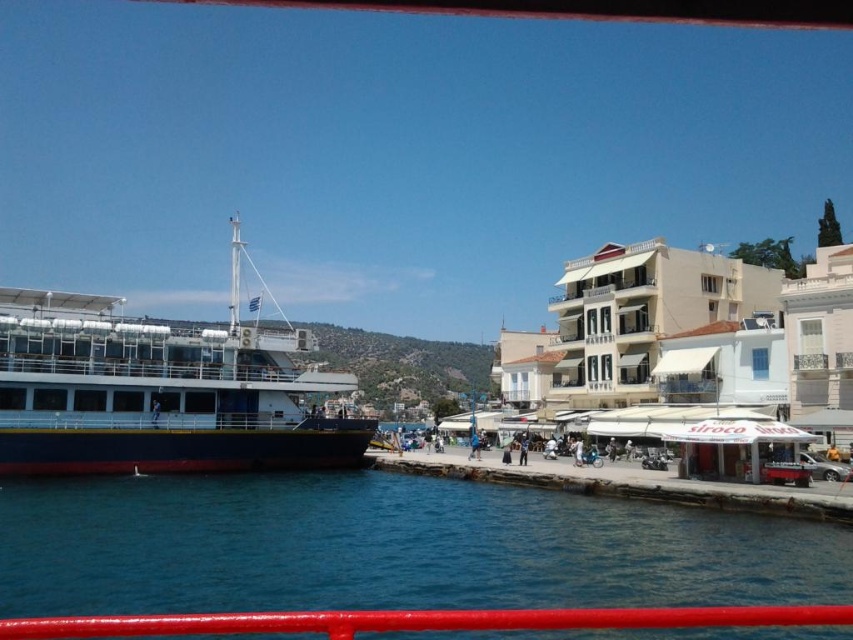
You are a photographer planning to take a photo of the blue matte ship at left and the blue fabric umbrella at lower center. Since you want both objects to appear balanced in the frame, which object should you zoom in on more to make them look similar in size?

The blue matte ship at left is larger in size than the blue fabric umbrella at lower center, so you should zoom in more on the blue fabric umbrella at lower center to make it appear larger in the photo, balancing its size with the ship.

You are a tour guide standing at the center of the image. You need to point out the blue matte ship at left to your tourists. Which direction should you face to show them the ship?

The blue matte ship at left is located at point (x=160, y=390), which is to the left side of the image. Therefore, you should face the left direction to show the tourists the blue matte ship at left.

You are a photographer trying to capture the entire blue water at lower left and blue fabric umbrella at lower center in one frame. Which object should you focus on to ensure both fit in the shot?

Since the blue water at lower left is wider than the blue fabric umbrella at lower center, you should focus on the blue water at lower left to ensure both fit in the frame.